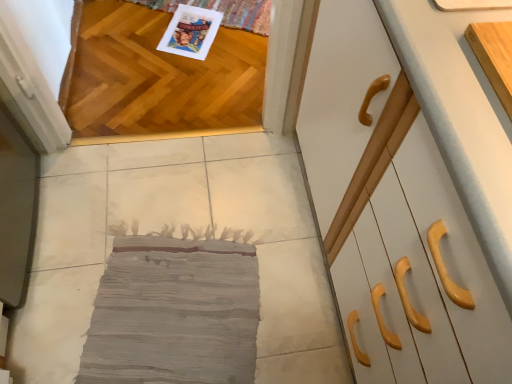
Describe the element at coordinates (494, 56) in the screenshot. I see `light wood cutting board at upper right, arranged as the 2th cabinetry when viewed from the front` at that location.

Locate an element on the screen. light wood cutting board at upper right, arranged as the 2th cabinetry when viewed from the front is located at coordinates (494, 56).

Is point (230, 139) positioned behind point (456, 226)?

Yes, point (230, 139) is farther from viewer.

Relative to white glossy cabinet at right, the first cabinetry when ordered from front to back, is gray fabric rug at center in front or behind?

Visually, gray fabric rug at center is located behind white glossy cabinet at right, the first cabinetry when ordered from front to back.

Consider the image. Which is correct: gray fabric rug at center is inside white glossy cabinet at right, the first cabinetry when ordered from front to back, or outside of it?

gray fabric rug at center is outside white glossy cabinet at right, the first cabinetry when ordered from front to back.

In the scene shown: Which of these two, gray fabric rug at center or white glossy cabinet at right, the 2th cabinetry viewed from the back, is thinner?

white glossy cabinet at right, the 2th cabinetry viewed from the back.

Based on their positions, is shiny oak hardwood at upper left located to the left or right of white glossy cabinet at right, the first cabinetry when ordered from front to back?

shiny oak hardwood at upper left is positioned on white glossy cabinet at right, the first cabinetry when ordered from front to back,'s left side.

Consider the image. Does shiny oak hardwood at upper left have a greater width compared to white glossy cabinet at right, the first cabinetry when ordered from front to back?

Yes, shiny oak hardwood at upper left is wider than white glossy cabinet at right, the first cabinetry when ordered from front to back.

Which is behind, point (96, 13) or point (386, 171)?

The point (96, 13) is more distant.

From the picture: How many degrees apart are the facing directions of shiny oak hardwood at upper left and white glossy cabinet at right, the first cabinetry when ordered from front to back?

The facing directions of shiny oak hardwood at upper left and white glossy cabinet at right, the first cabinetry when ordered from front to back, are 90 degrees apart.

What's the angular difference between shiny oak hardwood at upper left and gray fabric rug at center's facing directions?

The angular difference between shiny oak hardwood at upper left and gray fabric rug at center is 180 degrees.

Which point is more forward, (93,127) or (88,184)?

The point (88,184) is closer.

I want to click on concrete positioned vertically above the shiny oak hardwood at upper left (from a real-world perspective), so click(x=178, y=237).

Between point (441, 119) and point (59, 312), which one is positioned behind?

The point (59, 312) is behind.

Does white glossy cabinet at right, the 2th cabinetry viewed from the back, have a larger size compared to gray fabric rug at center?

Indeed, white glossy cabinet at right, the 2th cabinetry viewed from the back, has a larger size compared to gray fabric rug at center.

You are a GUI agent. You are given a task and a screenshot of the screen. Output one action in this format:
    pyautogui.click(x=<x>, y=<y>)
    Task: Click on the cabinetry that is the 1st one when counting upward from the gray fabric rug at center (from the image's perspective)
    This screenshot has height=384, width=512.
    Given the screenshot: What is the action you would take?
    pyautogui.click(x=410, y=191)

Measure the distance between white glossy cabinet at right, the first cabinetry when ordered from front to back, and gray fabric rug at center.

23.66 inches.

Based on the photo, who is more distant, white glossy cabinet at right, the 2th cabinetry viewed from the back, or shiny oak hardwood at upper left?

shiny oak hardwood at upper left.

Looking at this image, from the image's perspective, which object appears higher, white glossy cabinet at right, the first cabinetry when ordered from front to back, or shiny oak hardwood at upper left?

shiny oak hardwood at upper left, from the image's perspective.

Is white glossy cabinet at right, the 2th cabinetry viewed from the back, positioned with its back to shiny oak hardwood at upper left?

white glossy cabinet at right, the 2th cabinetry viewed from the back, is not turned away from shiny oak hardwood at upper left.

Could you tell me if light wood cutting board at upper right, arranged as the 2th cabinetry when viewed from the front, is turned towards white glossy cabinet at right, the first cabinetry when ordered from front to back?

Yes, light wood cutting board at upper right, arranged as the 2th cabinetry when viewed from the front, is turned towards white glossy cabinet at right, the first cabinetry when ordered from front to back.

Considering the points (502, 90) and (470, 350), which point is behind, point (502, 90) or point (470, 350)?

The point (502, 90) is more distant.

Locate an element on the screen. The image size is (512, 384). cabinetry behind the white glossy cabinet at right, the first cabinetry when ordered from front to back is located at coordinates (494, 56).

From a real-world perspective, which is physically below, light wood cutting board at upper right, arranged as the 2th cabinetry when viewed from the front, or white glossy cabinet at right, the first cabinetry when ordered from front to back?

white glossy cabinet at right, the first cabinetry when ordered from front to back, from a real-world perspective.

From a real-world perspective, between light wood cutting board at upper right, arranged as the 2th cabinetry when viewed from the front, and shiny oak hardwood at upper left, who is vertically higher?

From a 3D spatial view, light wood cutting board at upper right, arranged as the 2th cabinetry when viewed from the front, is above.

Which of these two, light wood cutting board at upper right, arranged as the 2th cabinetry when viewed from the front, or shiny oak hardwood at upper left, stands shorter?

light wood cutting board at upper right, arranged as the 2th cabinetry when viewed from the front.

Image resolution: width=512 pixels, height=384 pixels. In order to click on concrete on the left of white glossy cabinet at right, the first cabinetry when ordered from front to back in this screenshot , I will do `click(178, 237)`.

Image resolution: width=512 pixels, height=384 pixels. Find the location of `hardwood lying behind the white glossy cabinet at right, the first cabinetry when ordered from front to back`. hardwood lying behind the white glossy cabinet at right, the first cabinetry when ordered from front to back is located at coordinates (159, 76).

Based on their spatial positions, is shiny oak hardwood at upper left or gray fabric rug at center closer to light wood cutting board at upper right, the first cabinetry positioned from the back?

gray fabric rug at center.

From the image, which object appears to be nearer to white glossy cabinet at right, the first cabinetry when ordered from front to back, light wood cutting board at upper right, the first cabinetry positioned from the back, or gray fabric rug at center?

light wood cutting board at upper right, the first cabinetry positioned from the back, lies closer to white glossy cabinet at right, the first cabinetry when ordered from front to back, than the other object.

Considering their positions, is gray fabric rug at center positioned closer to shiny oak hardwood at upper left than light wood cutting board at upper right, the first cabinetry positioned from the back?

gray fabric rug at center.

From the image, which object appears to be farther from gray fabric rug at center, white glossy cabinet at right, the first cabinetry when ordered from front to back, or shiny oak hardwood at upper left?

white glossy cabinet at right, the first cabinetry when ordered from front to back, is positioned further to the anchor gray fabric rug at center.

Based on their spatial positions, is shiny oak hardwood at upper left or white glossy cabinet at right, the 2th cabinetry viewed from the back, further from gray fabric rug at center?

white glossy cabinet at right, the 2th cabinetry viewed from the back, is further to gray fabric rug at center.

From the image, which object appears to be nearer to light wood cutting board at upper right, arranged as the 2th cabinetry when viewed from the front, shiny oak hardwood at upper left or white glossy cabinet at right, the 2th cabinetry viewed from the back?

Based on the image, white glossy cabinet at right, the 2th cabinetry viewed from the back, appears to be nearer to light wood cutting board at upper right, arranged as the 2th cabinetry when viewed from the front.

Looking at the image, which one is located further to white glossy cabinet at right, the first cabinetry when ordered from front to back, light wood cutting board at upper right, the first cabinetry positioned from the back, or shiny oak hardwood at upper left?

shiny oak hardwood at upper left is positioned further to the anchor white glossy cabinet at right, the first cabinetry when ordered from front to back.

Looking at the image, which one is located closer to shiny oak hardwood at upper left, gray fabric rug at center or white glossy cabinet at right, the first cabinetry when ordered from front to back?

gray fabric rug at center.

Where is `cabinetry between gray fabric rug at center and light wood cutting board at upper right, the first cabinetry positioned from the back, in the horizontal direction`? This screenshot has height=384, width=512. cabinetry between gray fabric rug at center and light wood cutting board at upper right, the first cabinetry positioned from the back, in the horizontal direction is located at coordinates (410, 191).

Where is `cabinetry located between white glossy cabinet at right, the first cabinetry when ordered from front to back, and shiny oak hardwood at upper left in the depth direction`? cabinetry located between white glossy cabinet at right, the first cabinetry when ordered from front to back, and shiny oak hardwood at upper left in the depth direction is located at coordinates (494, 56).

Where is `concrete between white glossy cabinet at right, the first cabinetry when ordered from front to back, and shiny oak hardwood at upper left in the front-back direction`? concrete between white glossy cabinet at right, the first cabinetry when ordered from front to back, and shiny oak hardwood at upper left in the front-back direction is located at coordinates (178, 237).

Locate an element on the screen. This screenshot has width=512, height=384. concrete between light wood cutting board at upper right, the first cabinetry positioned from the back, and shiny oak hardwood at upper left from front to back is located at coordinates (178, 237).